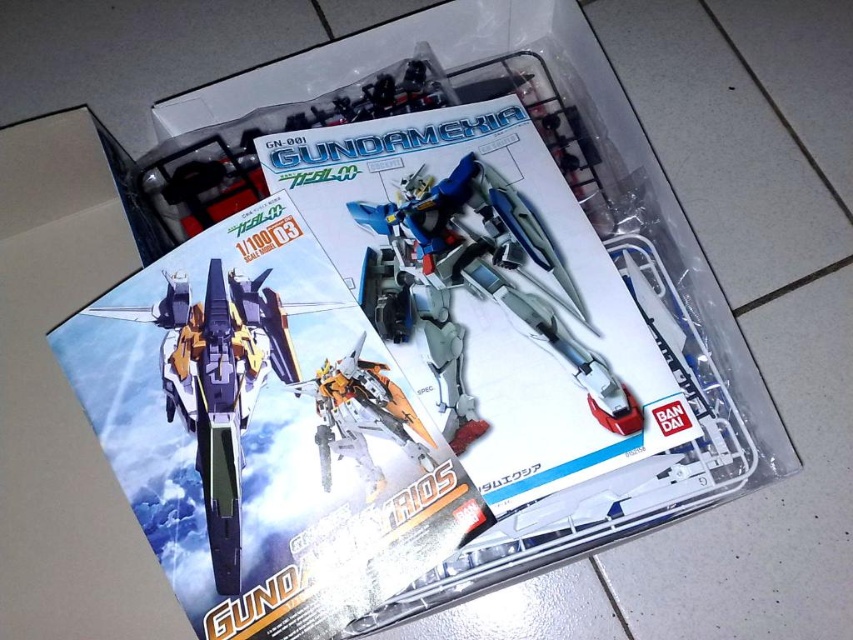
Question: Observing the image, what is the correct spatial positioning of matte silver fighter jet at center in reference to metallic silver robot at center?

Choices:
 (A) below
 (B) above

Answer: (A)

Question: Does matte silver fighter jet at center appear on the left side of metallic silver robot at center?

Choices:
 (A) yes
 (B) no

Answer: (A)

Question: Among these objects, which one is farthest from the camera?

Choices:
 (A) metallic silver robot at center
 (B) matte silver fighter jet at center

Answer: (A)

Question: Which point appears farthest from the camera in this image?

Choices:
 (A) (231, 424)
 (B) (357, 346)

Answer: (B)

Question: Can you confirm if matte silver fighter jet at center is positioned above metallic silver robot at center?

Choices:
 (A) yes
 (B) no

Answer: (B)